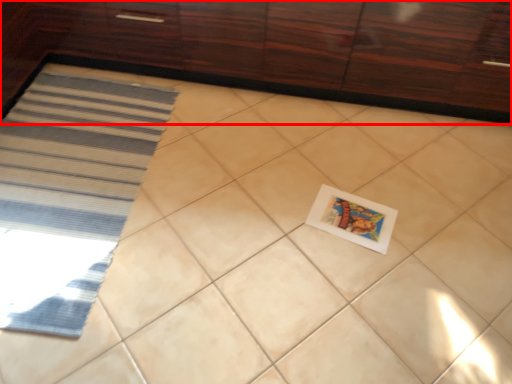
Question: From the image's perspective, where is cabinetry (annotated by the red box) located relative to postcard?

Choices:
 (A) below
 (B) above

Answer: (B)